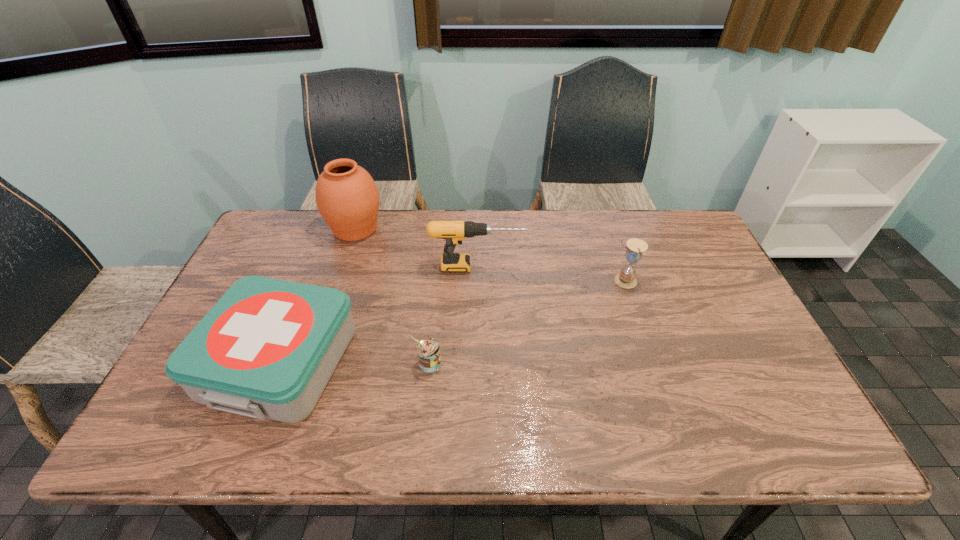
Find the location of a particular element. vacant space situated 0.330m on the left of the can is located at coordinates (282, 363).

What are the coordinates of `object located at the far edge` in the screenshot? It's located at (347, 197).

I want to click on object that is at the near edge, so click(x=267, y=349).

At what (x,y) coordinates should I click in order to perform the action: click on object that is at the left edge. Please return your answer as a coordinate pair (x, y). The image size is (960, 540). Looking at the image, I should click on (267, 349).

The width and height of the screenshot is (960, 540). I want to click on object that is at the near left corner, so click(267, 349).

The height and width of the screenshot is (540, 960). What are the coordinates of `vacant space at the far edge of the desktop` in the screenshot? It's located at (569, 224).

You are a GUI agent. You are given a task and a screenshot of the screen. Output one action in this format:
    pyautogui.click(x=<x>, y=<y>)
    Task: Click on the vacant region at the near edge of the desktop
    The width and height of the screenshot is (960, 540).
    Given the screenshot: What is the action you would take?
    pyautogui.click(x=634, y=416)

Where is `vacant space at the right edge of the desktop`? Image resolution: width=960 pixels, height=540 pixels. vacant space at the right edge of the desktop is located at coordinates (713, 306).

What are the coordinates of `blank space at the far left corner` in the screenshot? It's located at (293, 219).

Identify the location of vacant area at the far right corner. This screenshot has width=960, height=540. (657, 233).